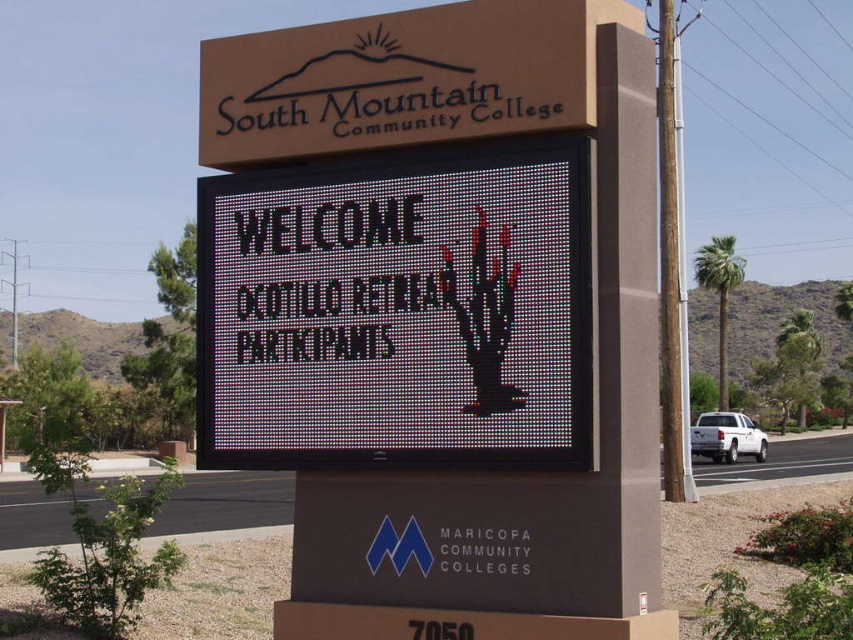
Question: Is matte black sign at center bigger than black pixelated cactus at center?

Choices:
 (A) yes
 (B) no

Answer: (B)

Question: Is matte black sign at center above black pixelated cactus at center?

Choices:
 (A) no
 (B) yes

Answer: (A)

Question: Does matte black sign at center appear under black pixelated cactus at center?

Choices:
 (A) yes
 (B) no

Answer: (A)